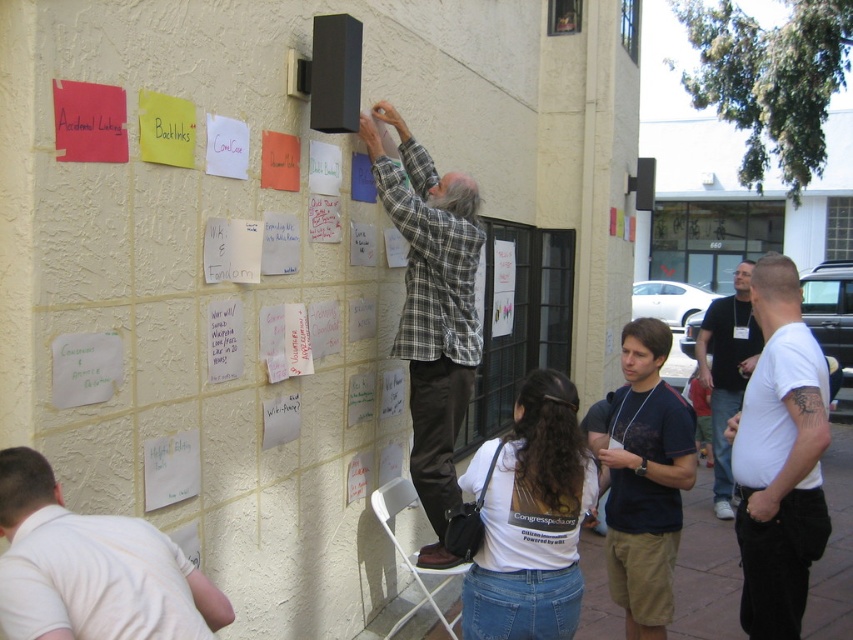
Between white cotton t-shirt at right and white t-shirt at right, which one has less height?

white cotton t-shirt at right is shorter.

Is point (738, 445) positioned after point (723, 452)?

No, (738, 445) is closer to viewer.

Where is `white cotton t-shirt at right`? The image size is (853, 640). white cotton t-shirt at right is located at coordinates click(x=779, y=458).

What do you see at coordinates (91, 568) in the screenshot?
I see `white matte shirt at lower left` at bounding box center [91, 568].

This screenshot has width=853, height=640. I want to click on white matte shirt at lower left, so click(x=91, y=568).

Find the location of `white matte shirt at lower left`. white matte shirt at lower left is located at coordinates (91, 568).

Does white matte shirt at lower left lie in front of dark blue t-shirt at center?

That is True.

Who is more forward, (193, 588) or (654, 406)?

Positioned in front is point (193, 588).

The width and height of the screenshot is (853, 640). Identify the location of white matte shirt at lower left. click(x=91, y=568).